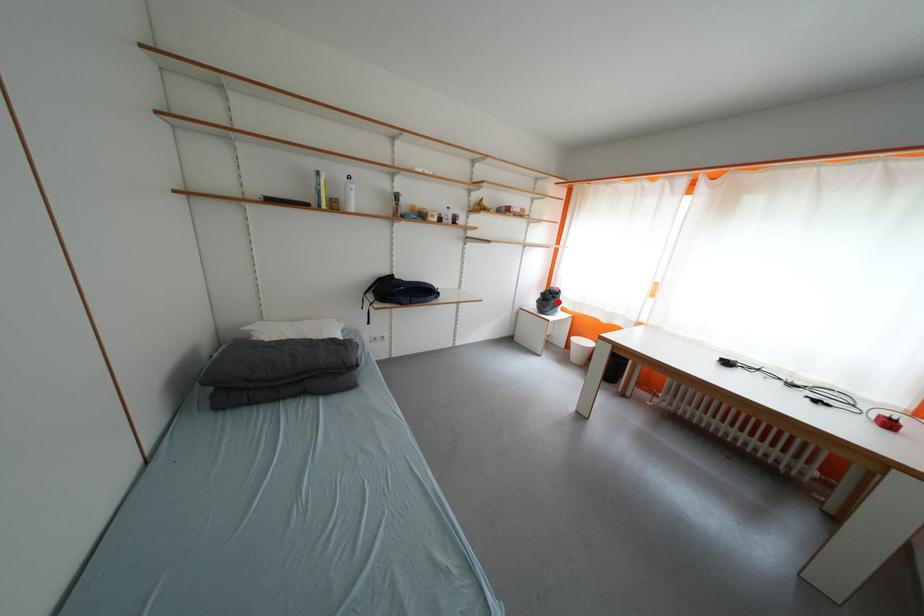
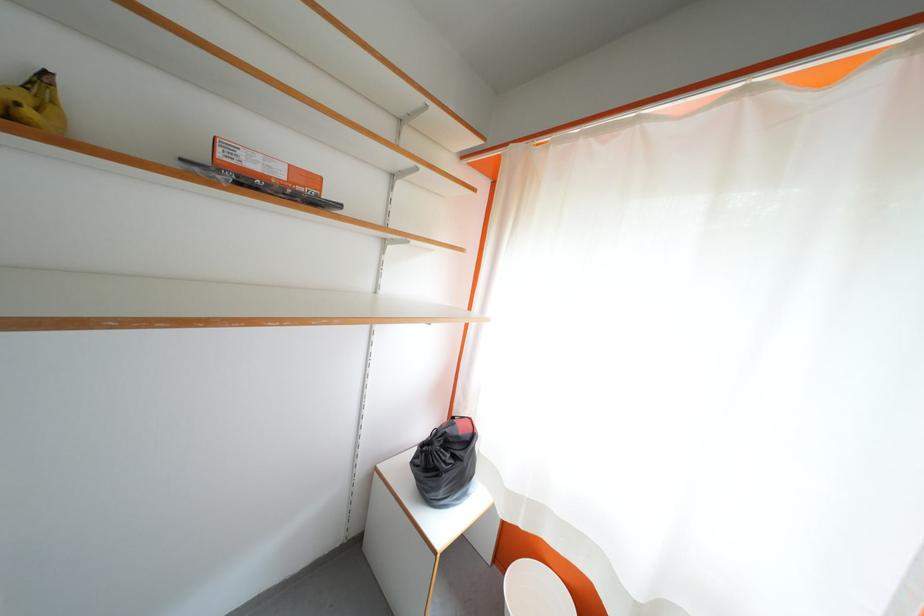
The point at the highlighted location is marked in the first image. Where is the corresponding point in the second image?

(455, 460)